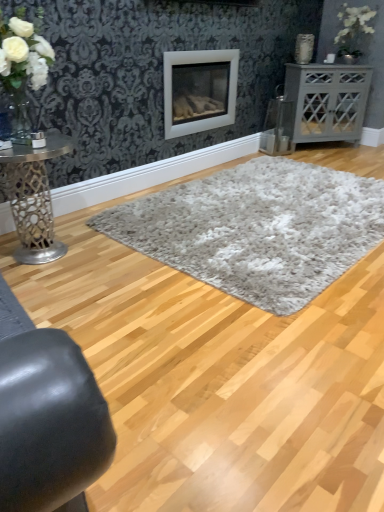
Locate an element on the screen. free space underneath metallic silver table at left, which is counted as the 1th table, starting from the bottom (from a real-world perspective) is located at coordinates (28, 266).